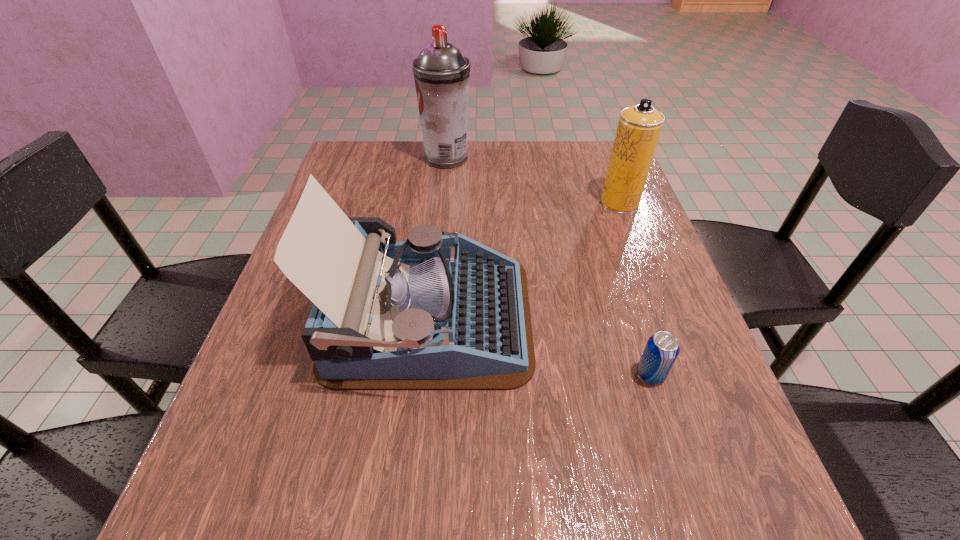
Where is `vacant space at the near right corner of the desktop`? vacant space at the near right corner of the desktop is located at coordinates (684, 514).

At what (x,y) coordinates should I click in order to perform the action: click on empty space between the shorter aerosol can and the left aerosol can. Please return your answer as a coordinate pair (x, y). Image resolution: width=960 pixels, height=540 pixels. Looking at the image, I should click on (533, 180).

This screenshot has width=960, height=540. Identify the location of blank region between the beer can and the typewriter. (540, 346).

Where is `vacant area that lies between the beer can and the shorter aerosol can`? Image resolution: width=960 pixels, height=540 pixels. vacant area that lies between the beer can and the shorter aerosol can is located at coordinates (636, 288).

Image resolution: width=960 pixels, height=540 pixels. Find the location of `empty location between the shorter aerosol can and the typewriter`. empty location between the shorter aerosol can and the typewriter is located at coordinates (524, 260).

Where is `free space between the shortest object and the left aerosol can`? The width and height of the screenshot is (960, 540). free space between the shortest object and the left aerosol can is located at coordinates (548, 266).

Where is `free space between the farther aerosol can and the shorter aerosol can`? This screenshot has width=960, height=540. free space between the farther aerosol can and the shorter aerosol can is located at coordinates (533, 180).

This screenshot has width=960, height=540. What are the coordinates of `free space between the shortest object and the typewriter` in the screenshot? It's located at (540, 346).

You are a GUI agent. You are given a task and a screenshot of the screen. Output one action in this format:
    pyautogui.click(x=<x>, y=<y>)
    Task: Click on the blank region between the shortest object and the shorter aerosol can
    The image size is (960, 540).
    Given the screenshot: What is the action you would take?
    pyautogui.click(x=636, y=288)

Locate an element on the screen. free point between the third nearest object and the typewriter is located at coordinates (524, 260).